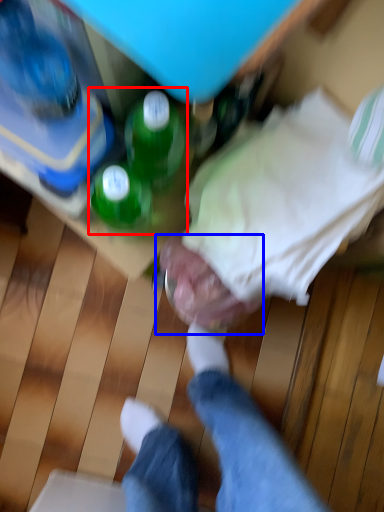
Question: Which of the following is the farthest to the observer, beverage (highlighted by a red box) or head (highlighted by a blue box)?

Choices:
 (A) beverage
 (B) head

Answer: (B)